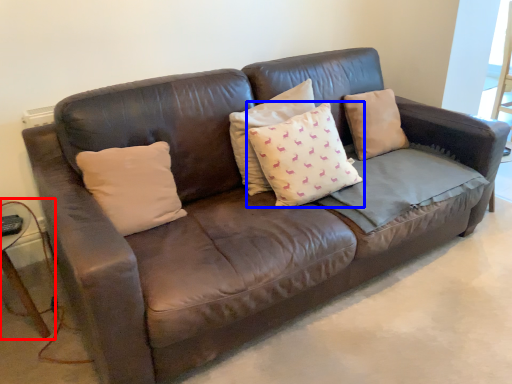
Question: Which of the following is the farthest to the observer, side table (highlighted by a red box) or pillow (highlighted by a blue box)?

Choices:
 (A) side table
 (B) pillow

Answer: (B)